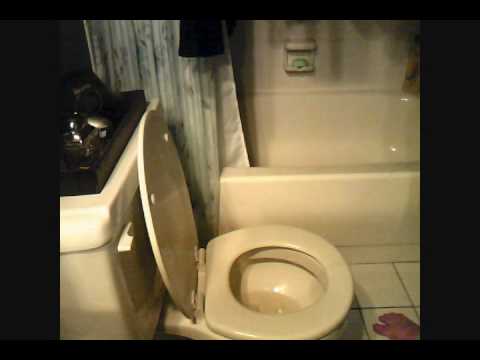
This screenshot has height=360, width=480. Identify the location of shower curtain. pos(230,109).